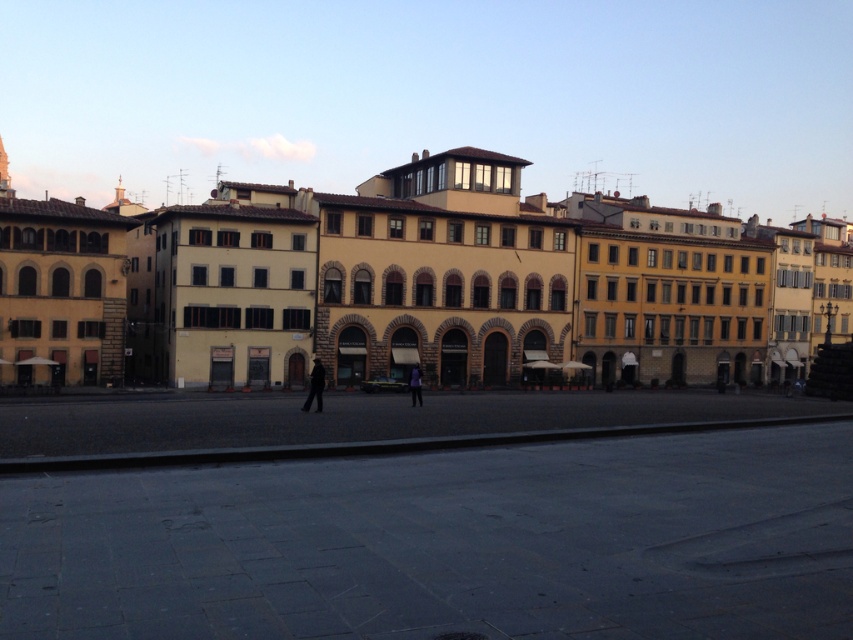
Looking at this image, who is shorter, yellow stone building at center or purple fabric person at center?

purple fabric person at center is shorter.

Is yellow stone building at center to the right of purple fabric person at center from the viewer's perspective?

Correct, you'll find yellow stone building at center to the right of purple fabric person at center.

I want to click on yellow stone building at center, so click(476, 284).

Based on the photo, does dark matte coat at center appear on the right side of purple fabric person at center?

Incorrect, dark matte coat at center is not on the right side of purple fabric person at center.

Is dark matte coat at center closer to camera compared to purple fabric person at center?

That is True.

Locate an element on the screen. dark matte coat at center is located at coordinates (315, 387).

This screenshot has width=853, height=640. Identify the location of dark matte coat at center. coord(315,387).

In the scene shown: Measure the distance between yellow stone building at center and dark matte coat at center.

yellow stone building at center and dark matte coat at center are 32.98 meters apart from each other.

Is point (467, 180) positioned before point (318, 365)?

No, (467, 180) is behind (318, 365).

You are a GUI agent. You are given a task and a screenshot of the screen. Output one action in this format:
    pyautogui.click(x=<x>, y=<y>)
    Task: Click on the yellow stone building at center
    The image size is (853, 640).
    Given the screenshot: What is the action you would take?
    pyautogui.click(x=476, y=284)